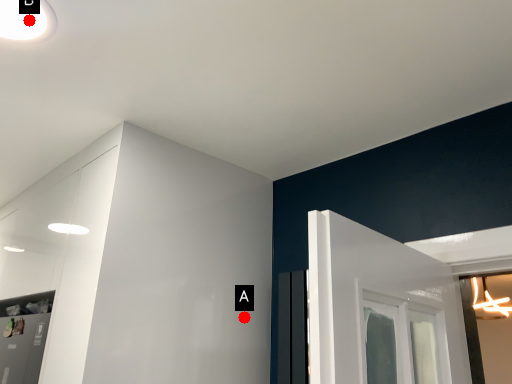
Question: Two points are circled on the image, labeled by A and B beside each circle. Which point is further to the camera?

Choices:
 (A) A is further
 (B) B is further

Answer: (A)